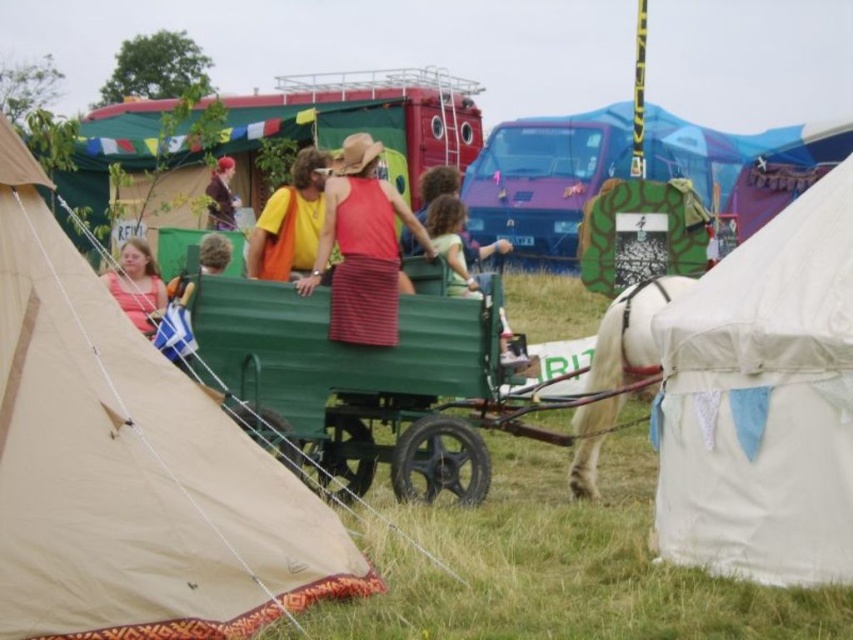
Where is the green corrugated wagon at center located in the image?

The green corrugated wagon at center is located at point [355,384].